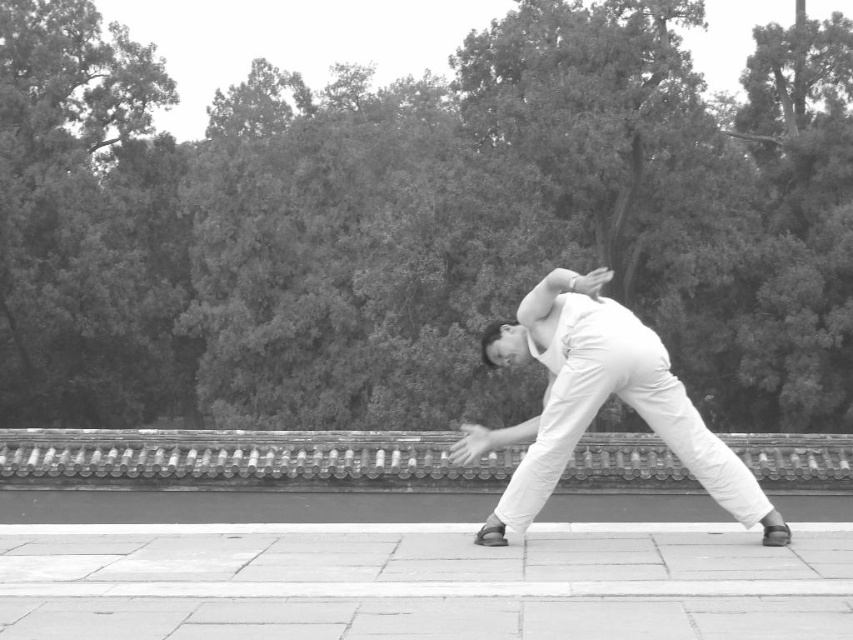
You are a photographer trying to capture the martial artist in the image. You want to ensure the white cotton pants at center are fully visible in the frame. Given the smooth concrete pavement at lower center is wider than the pants, should you adjust your camera angle to focus more on the pavement or the pants?

The smooth concrete pavement at lower center is wider than the white cotton pants at center. To ensure the pants are fully visible, you should adjust your camera angle to focus more on the pants rather than the pavement.

You are standing at the point marked by coordinates point (428, 584). What material are you standing on?

You are standing on smooth concrete pavement at lower center.

Consider the image. You are a photographer standing 5 meters away from the smooth concrete pavement at lower center. Can you step forward to touch the pavement without moving your feet?

The smooth concrete pavement at lower center is 4.60 meters away from the camera. Since you are standing 5 meters away, stepping forward would bring you closer, but you cannot touch it without moving your feet because the distance is already measured from your current position.